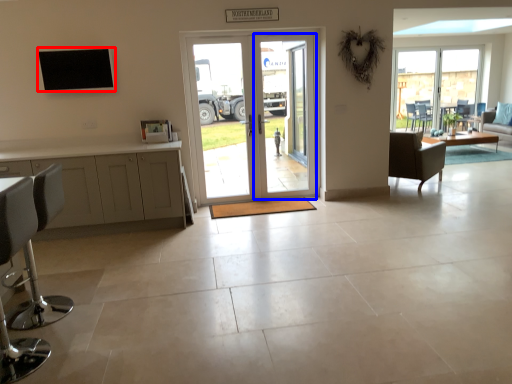
Question: Which object is further to the camera taking this photo, window (highlighted by a red box) or screen door (highlighted by a blue box)?

Choices:
 (A) window
 (B) screen door

Answer: (B)